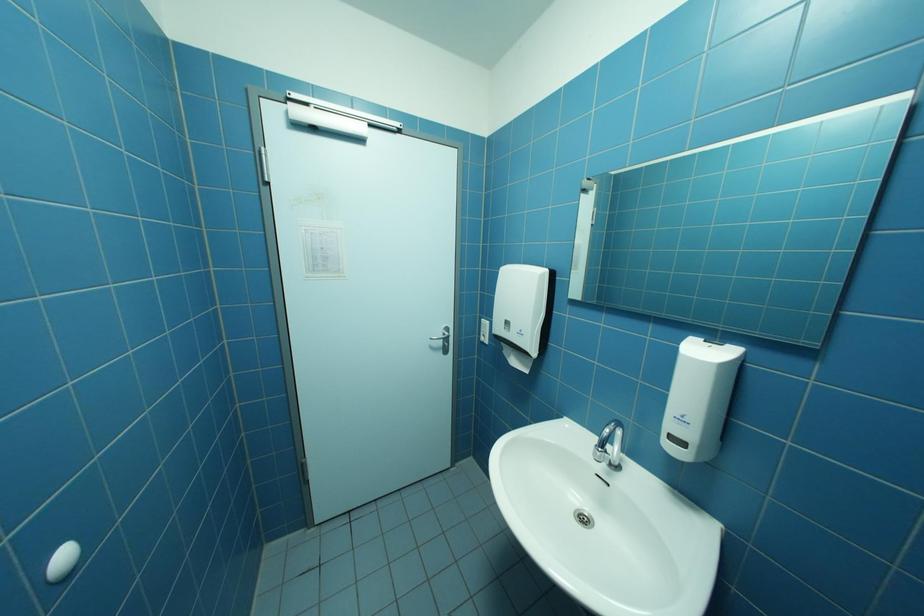
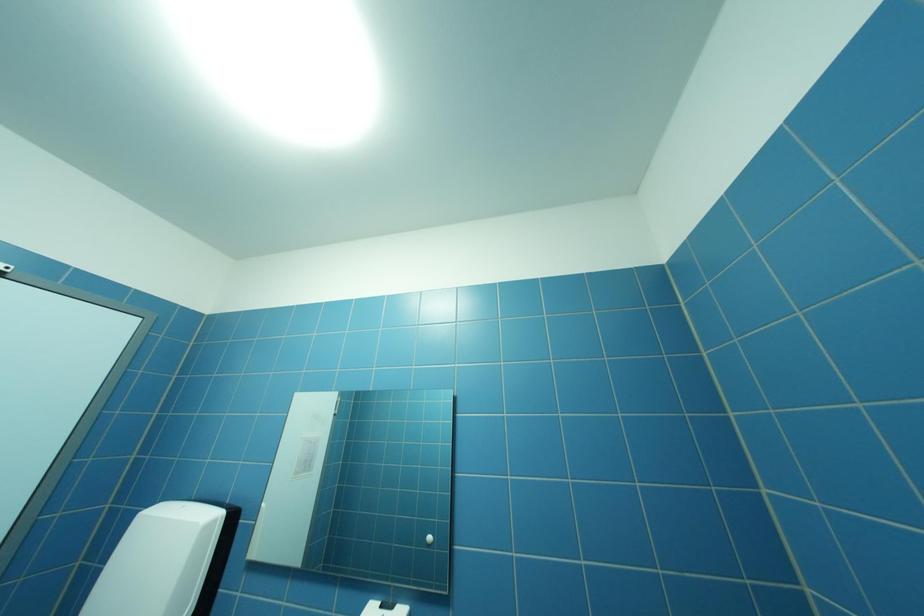
Based on the photo, the first image is from the beginning of the video and the second image is from the end. How did the camera likely rotate when shooting the video?

The rotation direction of the camera is right-up.